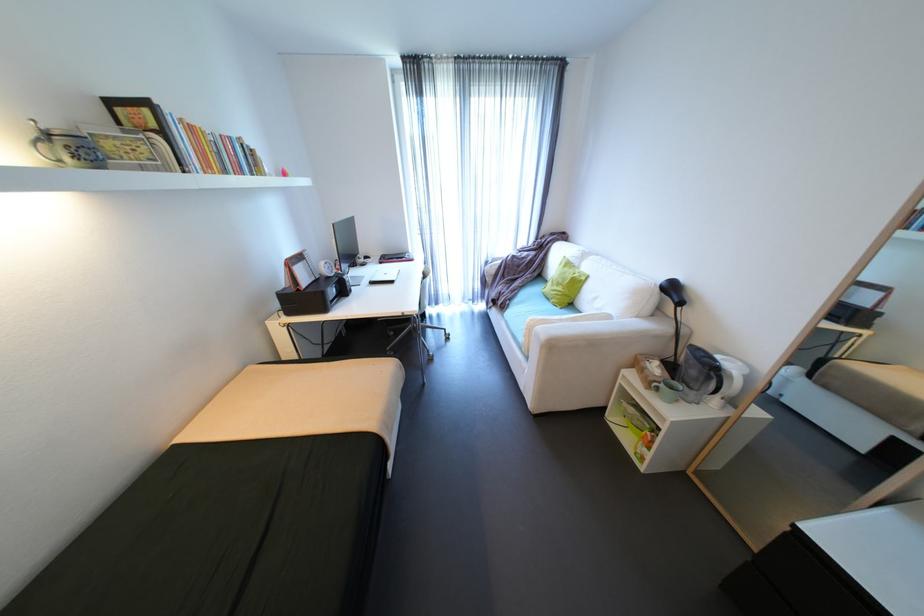
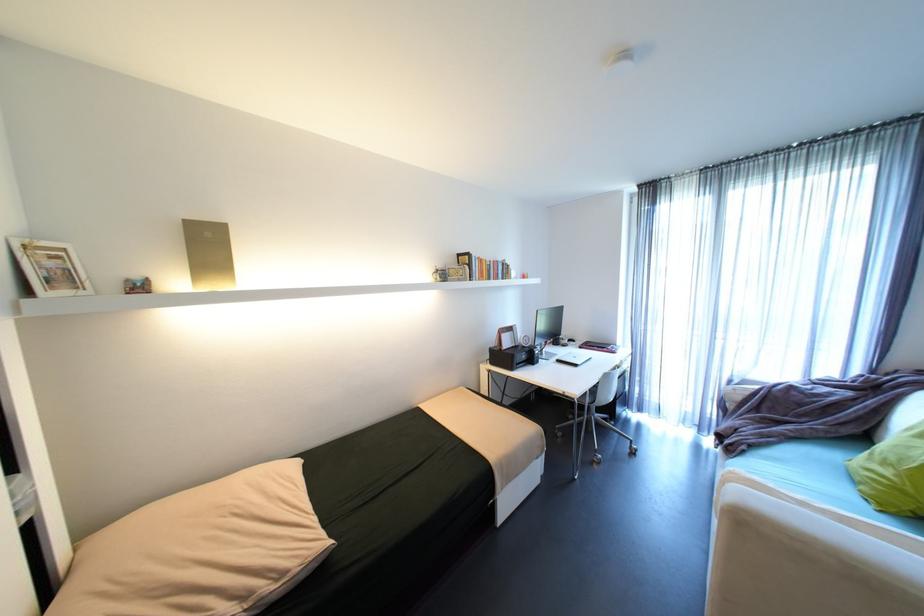
Find the pixel in the second image that matches (x=410, y=257) in the first image.

(612, 347)